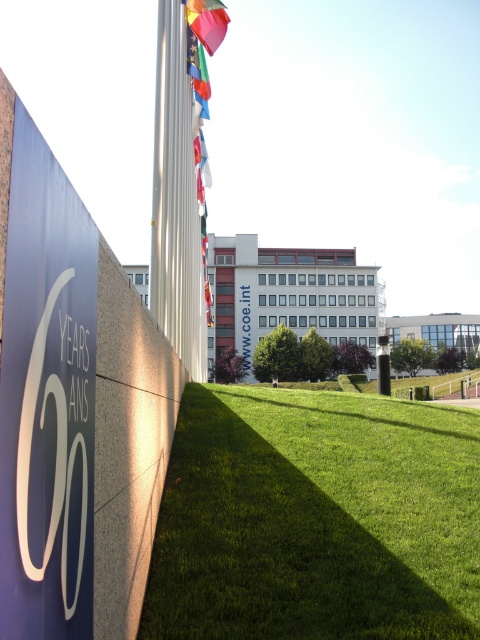
You are standing at the entrance of the building complex and want to walk towards the green grass at lower center. Which direction should you head relative to the white glossy logo at lower left?

The green grass at lower center is positioned on the right side of the white glossy logo at lower left, so you should head to the right of the white glossy logo at lower left to reach the green grass at lower center.

You are standing in front of the building complex and notice the green grass at lower center and the silky fabric flag at upper center. Which object is positioned to the right of the other?

The green grass at lower center is to the right of the silky fabric flag at upper center.

You are designing a poster for an event and need to include both the white glossy logo at lower left and the silky fabric flag at upper center. Which object should you scale up to make them visually balanced?

The white glossy logo at lower left occupies less space than the silky fabric flag at upper center, so you should scale up the white glossy logo at lower left to balance their sizes.